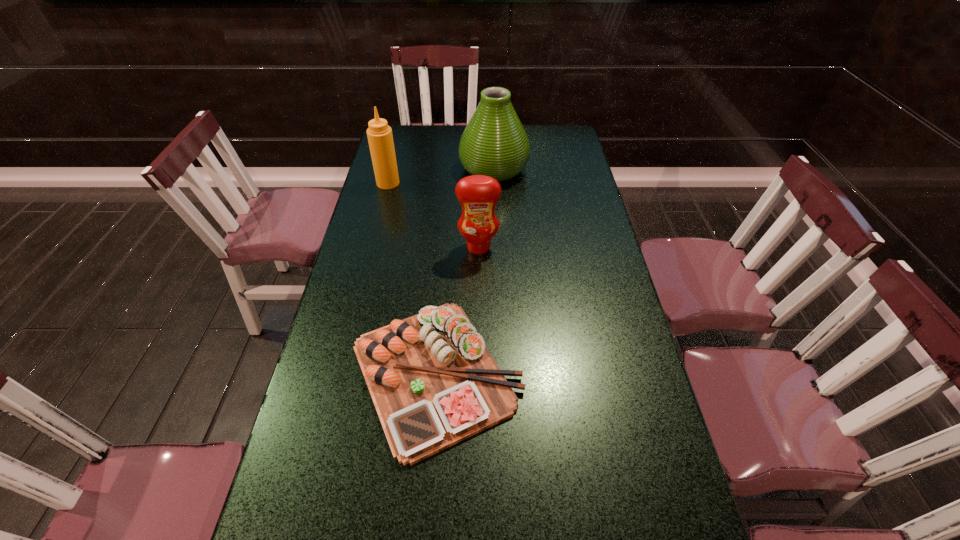
Locate an element on the screen. The height and width of the screenshot is (540, 960). object at the far edge is located at coordinates (494, 143).

Locate an element on the screen. This screenshot has height=540, width=960. condiment present at the left edge is located at coordinates (380, 138).

At what (x,y) coordinates should I click in order to perform the action: click on platter positioned at the left edge. Please return your answer as a coordinate pair (x, y). The image size is (960, 540). Looking at the image, I should click on (433, 382).

Find the location of a particular element. The image size is (960, 540). free location at the far edge is located at coordinates (458, 125).

In the image, there is a desktop. Where is `vacant space at the left edge`? The height and width of the screenshot is (540, 960). vacant space at the left edge is located at coordinates (312, 454).

Identify the location of vacant space at the right edge. (618, 284).

What are the coordinates of `blank area at the far left corner` in the screenshot? It's located at (412, 128).

What are the coordinates of `free space between the platter and the vase` in the screenshot? It's located at (465, 272).

This screenshot has height=540, width=960. I want to click on free spot between the left condiment and the shortest object, so click(412, 279).

Where is `vacant space that is in between the vase and the platter`? vacant space that is in between the vase and the platter is located at coordinates (465, 272).